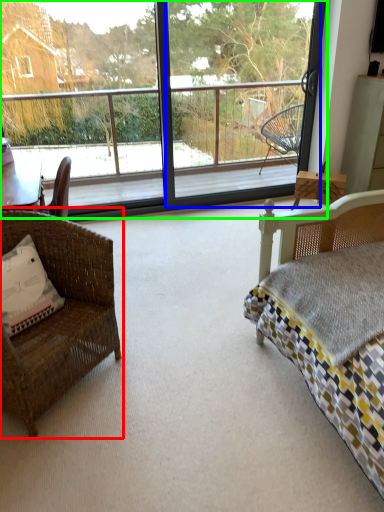
Question: Which object is the farthest from chair (highlighted by a red box)? Choose among these: screen door (highlighted by a blue box) or window (highlighted by a green box).

Choices:
 (A) screen door
 (B) window

Answer: (A)